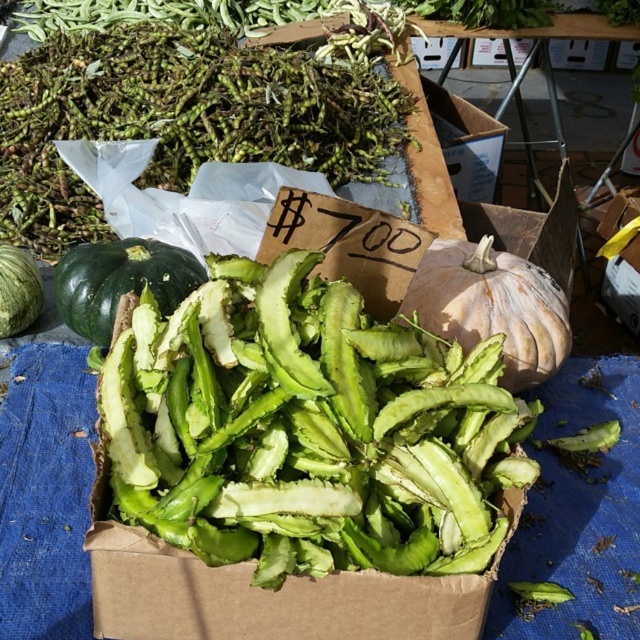
Is green matte string beans at center to the left of green matte pumpkin at left from the viewer's perspective?

In fact, green matte string beans at center is to the right of green matte pumpkin at left.

Does green matte string beans at center have a greater height compared to green matte pumpkin at left?

Yes.

What do you see at coordinates (308, 429) in the screenshot? The width and height of the screenshot is (640, 640). I see `green matte string beans at center` at bounding box center [308, 429].

Image resolution: width=640 pixels, height=640 pixels. I want to click on green matte string beans at center, so pyautogui.click(x=308, y=429).

What do you see at coordinates (308, 429) in the screenshot? The image size is (640, 640). I see `green matte string beans at center` at bounding box center [308, 429].

Between point (420, 392) and point (314, 131), which one is positioned in front?

Point (420, 392)

The width and height of the screenshot is (640, 640). What do you see at coordinates (308, 429) in the screenshot?
I see `green matte string beans at center` at bounding box center [308, 429].

You are a GUI agent. You are given a task and a screenshot of the screen. Output one action in this format:
    pyautogui.click(x=<x>, y=<y>)
    Task: Click on the green matte string beans at center
    The image size is (640, 640).
    Given the screenshot: What is the action you would take?
    pyautogui.click(x=308, y=429)

Is speckled white pumpkin at center closer to the viewer compared to green matte pumpkin at left?

Yes, it is in front of green matte pumpkin at left.

Where is `speckled white pumpkin at center`? speckled white pumpkin at center is located at coordinates [492, 307].

Locate an element on the screen. The height and width of the screenshot is (640, 640). speckled white pumpkin at center is located at coordinates (492, 307).